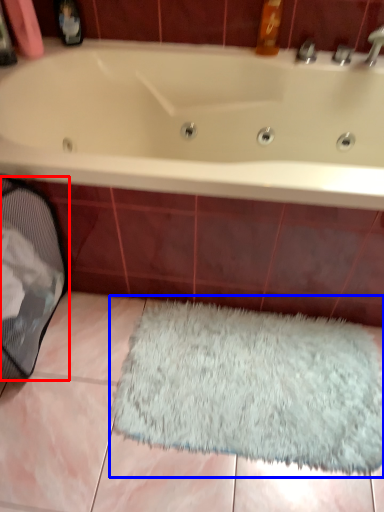
Question: Which object is closer to the camera taking this photo, laundry basket (highlighted by a red box) or doormat (highlighted by a blue box)?

Choices:
 (A) laundry basket
 (B) doormat

Answer: (A)